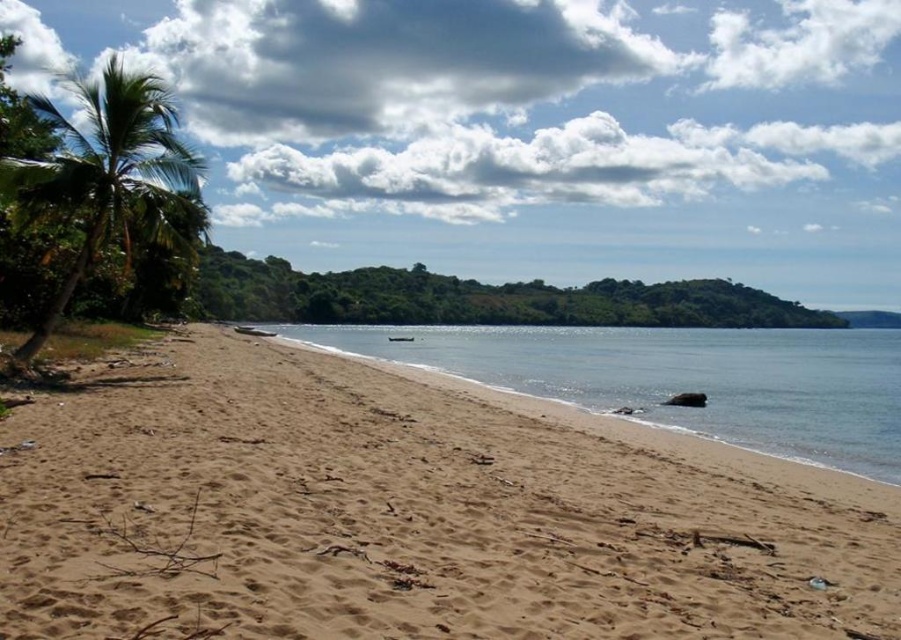
Who is shorter, clear blue water at center or green leafy palm tree at left?

Standing shorter between the two is clear blue water at center.

What do you see at coordinates (679, 378) in the screenshot? The image size is (901, 640). I see `clear blue water at center` at bounding box center [679, 378].

You are a GUI agent. You are given a task and a screenshot of the screen. Output one action in this format:
    pyautogui.click(x=<x>, y=<y>)
    Task: Click on the clear blue water at center
    This screenshot has width=901, height=640.
    Given the screenshot: What is the action you would take?
    pyautogui.click(x=679, y=378)

Is point (314, 602) positioned before point (851, 417)?

That is True.

The height and width of the screenshot is (640, 901). What are the coordinates of `sandy beach at lower left` in the screenshot? It's located at (410, 513).

Locate an element on the screen. The height and width of the screenshot is (640, 901). sandy beach at lower left is located at coordinates (410, 513).

Is sandy beach at lower left positioned before green leafy palm tree at left?

Yes, sandy beach at lower left is in front of green leafy palm tree at left.

Can you confirm if sandy beach at lower left is bigger than green leafy palm tree at left?

No.

Measure the distance between sandy beach at lower left and camera.

A distance of 3.83 meters exists between sandy beach at lower left and camera.

The image size is (901, 640). In order to click on sandy beach at lower left in this screenshot , I will do `click(410, 513)`.